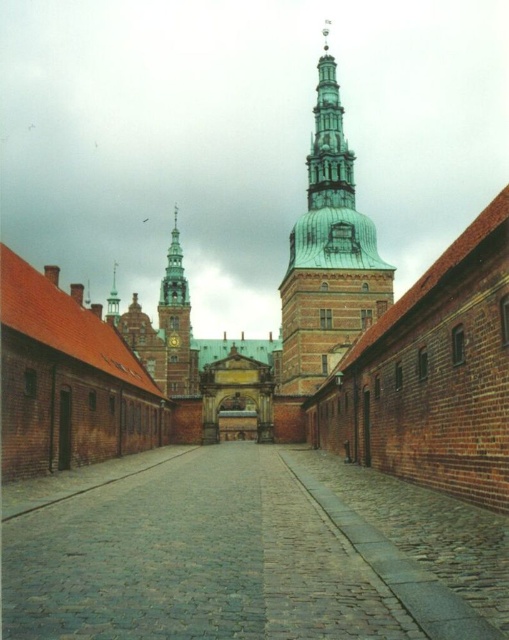
Is green copper roof at center below metallic gold clock at center?

No, green copper roof at center is not below metallic gold clock at center.

Describe the element at coordinates (327, 253) in the screenshot. I see `green copper roof at center` at that location.

Identify the location of green copper roof at center. (327, 253).

Between green copper roof at center and green copper tower at center, which one has less height?

With less height is green copper tower at center.

Can you confirm if green copper roof at center is shorter than green copper tower at center?

No.

Where is `green copper roof at center`? The image size is (509, 640). green copper roof at center is located at coordinates (327, 253).

The image size is (509, 640). What do you see at coordinates (327, 253) in the screenshot? I see `green copper roof at center` at bounding box center [327, 253].

Measure the distance between green copper roof at center and camera.

The distance of green copper roof at center from camera is 82.37 meters.

Find the location of a particular element. The width and height of the screenshot is (509, 640). green copper roof at center is located at coordinates (327, 253).